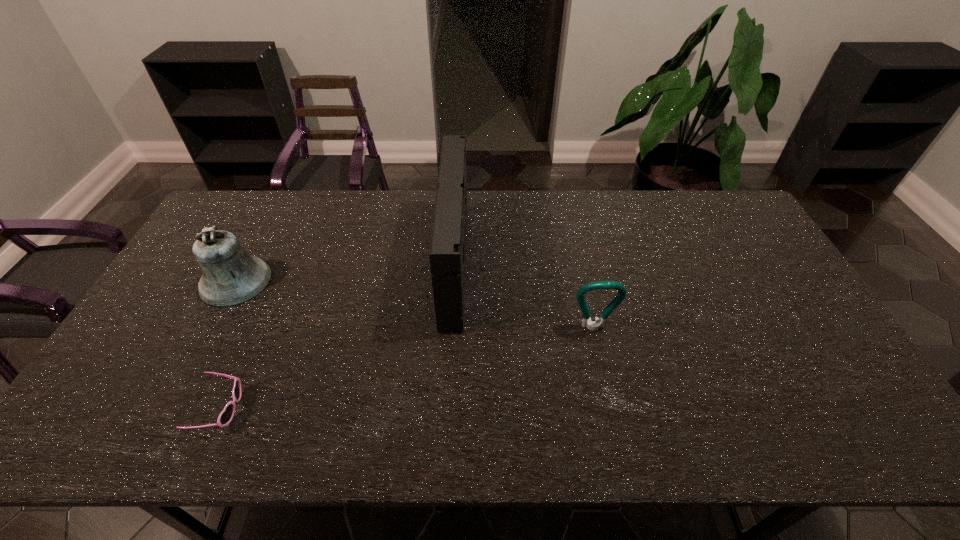
Find the location of `object that is positioned at the far edge`. object that is positioned at the far edge is located at coordinates (447, 255).

Locate an element on the screen. object present at the near edge is located at coordinates (226, 416).

Locate an element on the screen. object that is positioned at the left edge is located at coordinates (231, 277).

Identify the location of vacant space at the far edge of the desktop. (526, 214).

The width and height of the screenshot is (960, 540). In the image, there is a desktop. In order to click on blank space at the near edge in this screenshot , I will do `click(576, 413)`.

This screenshot has width=960, height=540. In the image, there is a desktop. Identify the location of vacant space at the left edge. (200, 321).

Locate an element on the screen. vacant space at the right edge of the desktop is located at coordinates (771, 342).

Where is `vacant region at the far left corner`? vacant region at the far left corner is located at coordinates (262, 194).

Where is `free location at the near left corner of the desktop`? free location at the near left corner of the desktop is located at coordinates (102, 414).

This screenshot has width=960, height=540. Find the location of `free region at the far right corner of the desktop`. free region at the far right corner of the desktop is located at coordinates (726, 191).